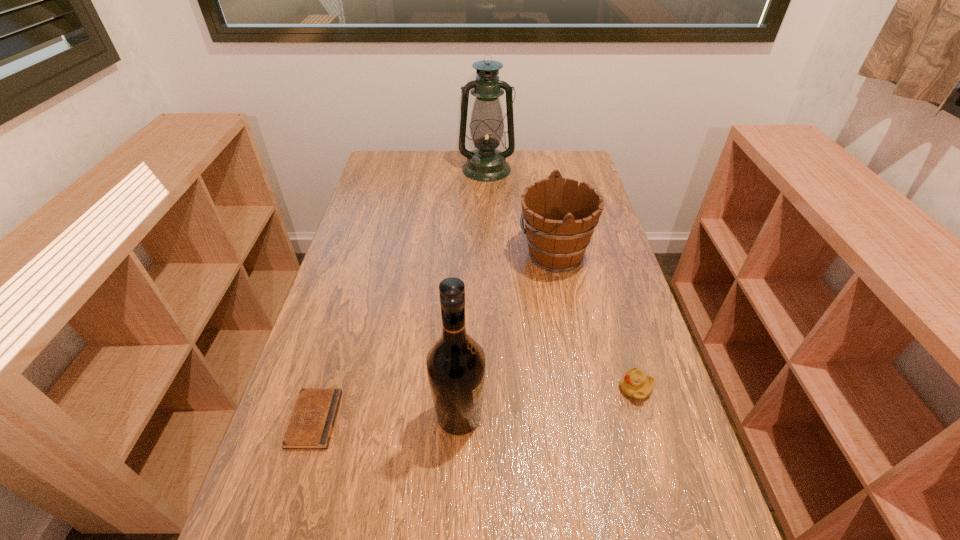
Image resolution: width=960 pixels, height=540 pixels. What are the coordinates of `vacant space situated 0.260m with the handle on the third tallest object` in the screenshot? It's located at (431, 253).

This screenshot has width=960, height=540. I want to click on vacant space situated 0.130m with the handle on the third tallest object, so click(x=474, y=253).

Identify the location of vacant position located 0.360m at the beak of the second shortest object. point(460,388).

The image size is (960, 540). Find the location of `vacant space located at the beak of the second shortest object`. vacant space located at the beak of the second shortest object is located at coordinates (553, 388).

Locate an element on the screen. The width and height of the screenshot is (960, 540). free space located at the beak of the second shortest object is located at coordinates 526,388.

What are the coordinates of `vacant region located on the spine side of the leftmost object` in the screenshot? It's located at (486, 420).

This screenshot has height=540, width=960. In order to click on object that is at the far edge in this screenshot , I will do `click(486, 163)`.

I want to click on object that is at the left edge, so [311, 424].

The height and width of the screenshot is (540, 960). Identify the location of wine bucket located at the right edge. (560, 217).

Image resolution: width=960 pixels, height=540 pixels. In order to click on duckling located in the right edge section of the desktop in this screenshot , I will do `click(635, 384)`.